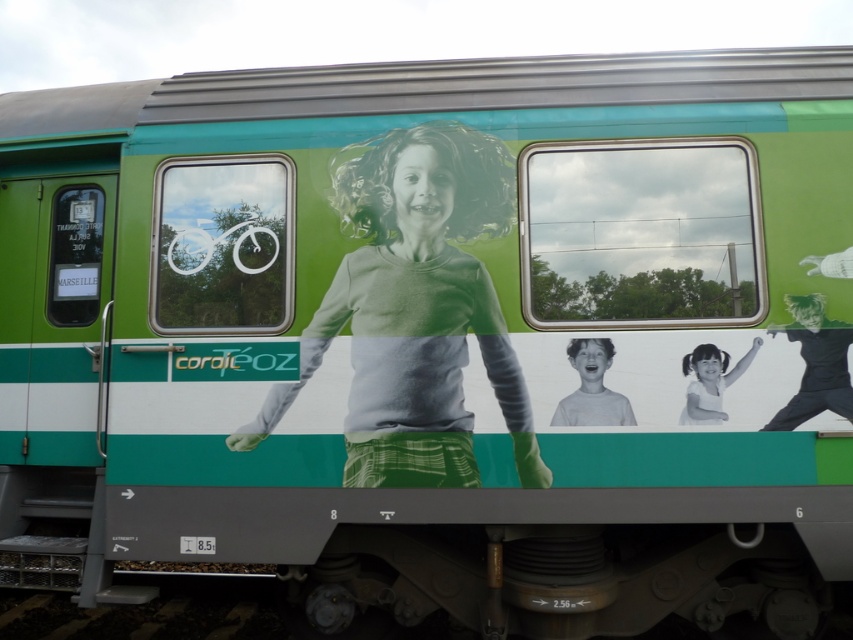
Does point (387, 486) lie in front of point (747, 353)?

No.

Does gray matte shirt at center appear under white paper at center?

No.

Is point (369, 392) positioned in front of point (755, 349)?

No, it is not.

At what (x,y) coordinates should I click in order to perform the action: click on gray matte shirt at center. Please return your answer as a coordinate pair (x, y). Image resolution: width=853 pixels, height=640 pixels. Looking at the image, I should click on (415, 310).

Is point (469, 412) closer to viewer compared to point (604, 371)?

No, (469, 412) is further to viewer.

Is gray matte shirt at center further to camera compared to matte white face at center?

That is True.

Locate an element on the screen. gray matte shirt at center is located at coordinates (415, 310).

Which is more to the right, black matte shirt at right or matte white face at center?

From the viewer's perspective, black matte shirt at right appears more on the right side.

Between point (779, 429) and point (596, 342), which one is positioned in front?

Positioned in front is point (779, 429).

Measure the distance between point (x=820, y=355) and camera.

Point (x=820, y=355) is 3.73 meters away from camera.

This screenshot has height=640, width=853. Identify the location of black matte shirt at right. (815, 364).